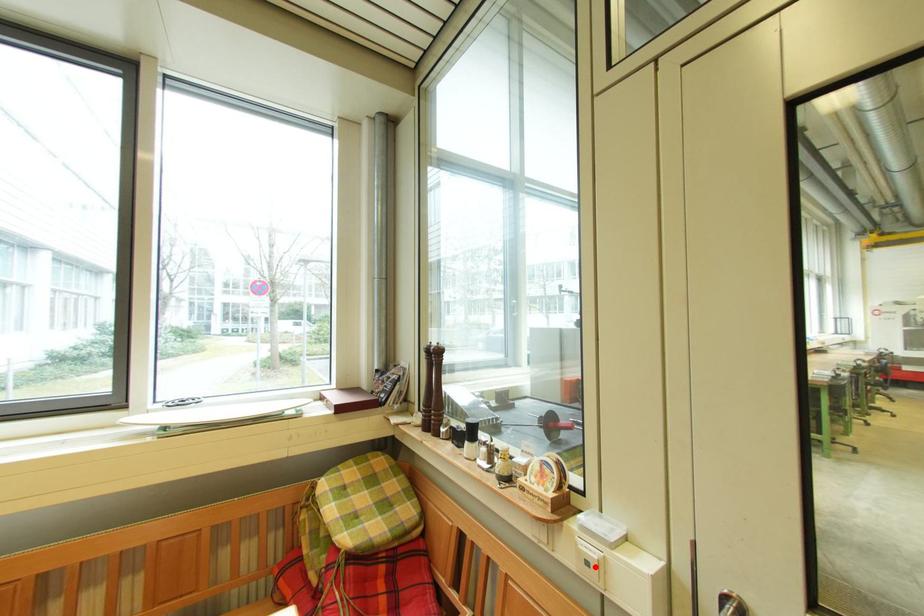
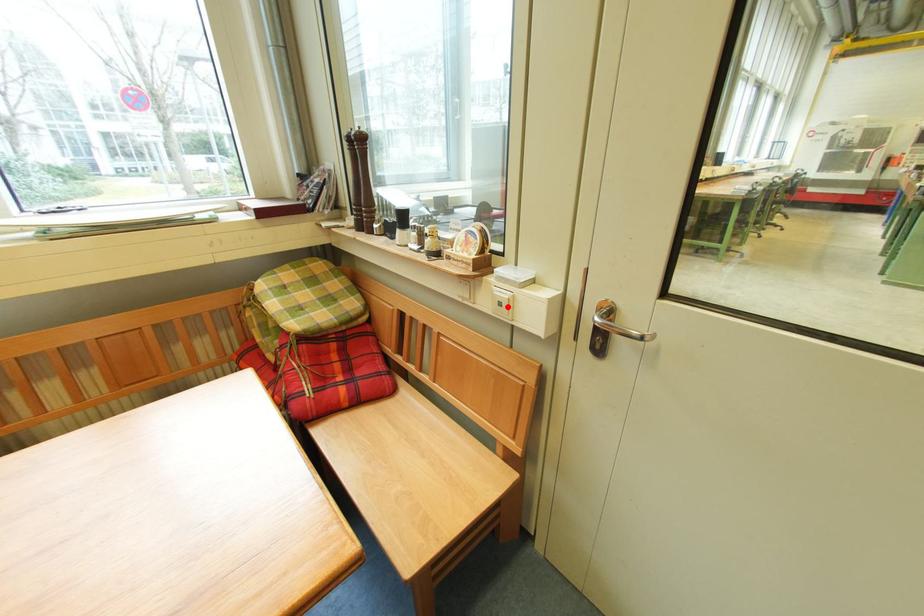
I am providing you with two images of the same scene from different viewpoints. A red point is marked on the first image and another point is marked on the second image. Is the red point in image1 aligned with the point shown in image2?

A: Yes